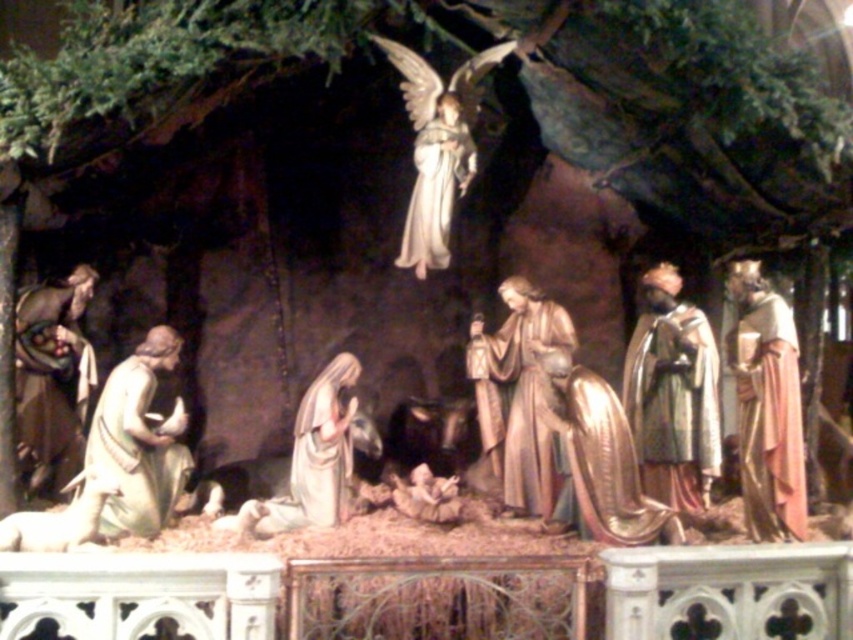
You are standing in the nativity scene and want to place a golden angel in the upper center. The coordinates given are point (437, 147). Is this the correct location for the angel?

Yes, the point (437, 147) indicates the gold metallic angel at upper center, so placing the angel there is correct.

In the nativity scene, there is a gold metallic angel at upper center and a white marble lamb at lower left. Which of these two objects is larger in size?

The gold metallic angel at upper center is bigger than the white marble lamb at lower left.